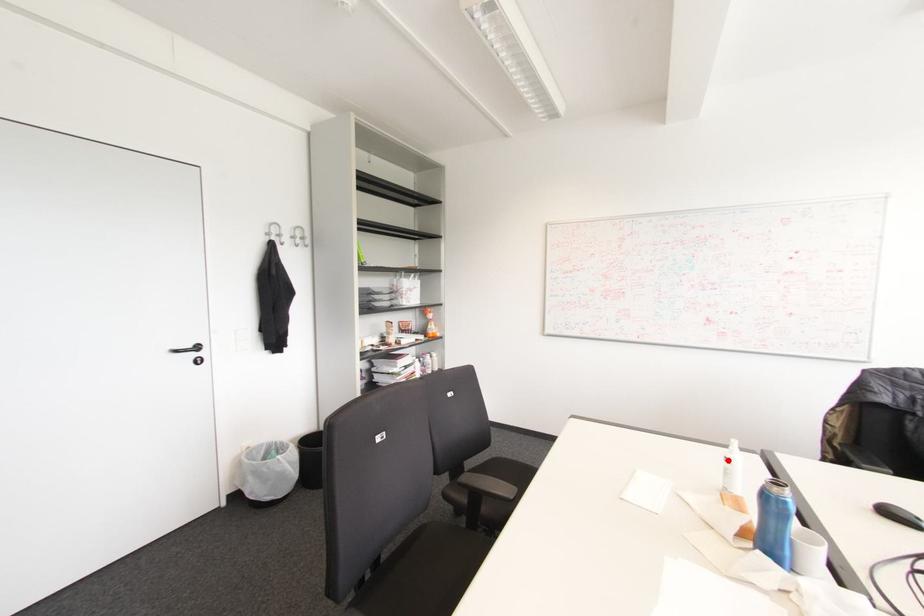
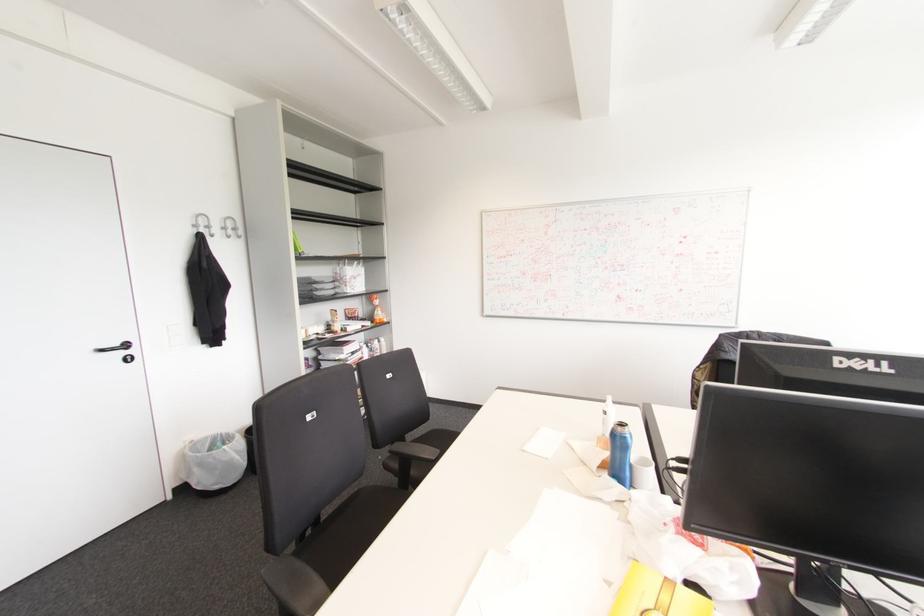
In the second image, find the point that corresponds to the highlighted location in the first image.

(604, 411)